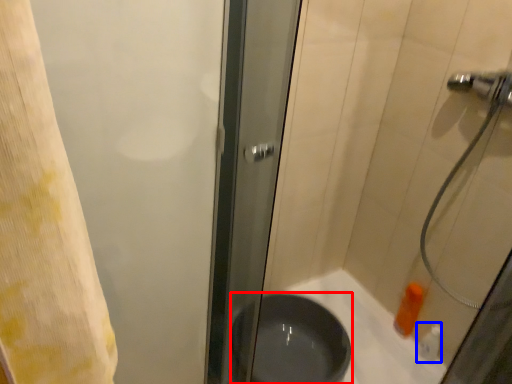
Question: Which point is closer to the camera, basin (highlighted by a red box) or toiletry (highlighted by a blue box)?

Choices:
 (A) basin
 (B) toiletry

Answer: (A)